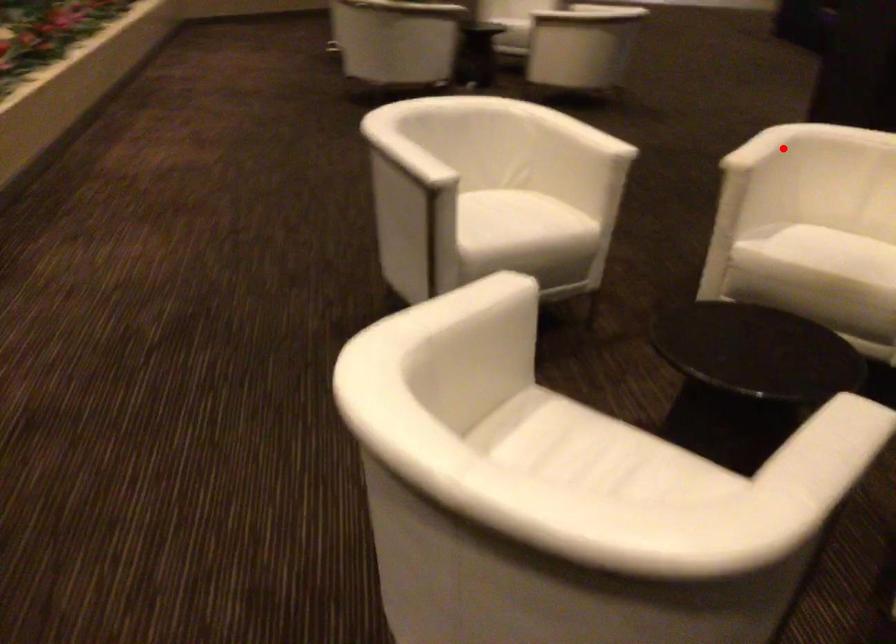
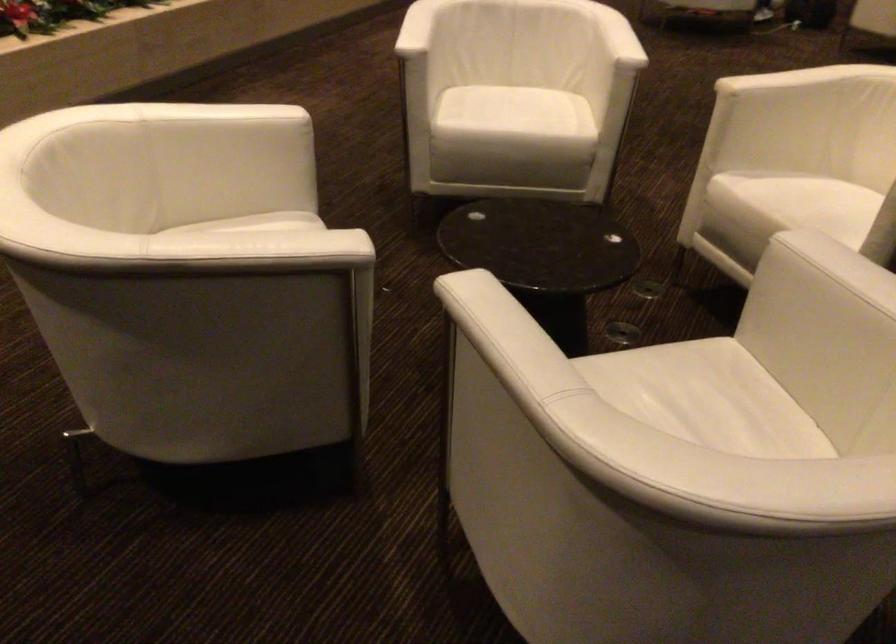
In the second image, find the point that corresponds to the highlighted location in the first image.

(789, 80)